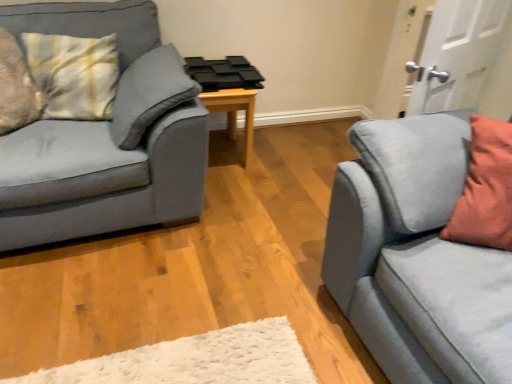
Question: From a real-world perspective, is matte blue couch at left, the first studio couch in the left-to-right sequence, positioned under suede blue studio couch at right, the first studio couch from the right, based on gravity?

Choices:
 (A) yes
 (B) no

Answer: (A)

Question: Is matte blue couch at left, the first studio couch in the left-to-right sequence, aimed at suede blue studio couch at right, the first studio couch from the right?

Choices:
 (A) no
 (B) yes

Answer: (A)

Question: Is matte blue couch at left, the first studio couch in the left-to-right sequence, directly adjacent to suede blue studio couch at right, the first studio couch from the right?

Choices:
 (A) yes
 (B) no

Answer: (B)

Question: Considering the relative positions of matte blue couch at left, which is the 2th studio couch from right to left, and suede blue studio couch at right, the first studio couch from the right, in the image provided, is matte blue couch at left, which is the 2th studio couch from right to left, to the right of suede blue studio couch at right, the first studio couch from the right, from the viewer's perspective?

Choices:
 (A) yes
 (B) no

Answer: (B)

Question: Can you confirm if matte blue couch at left, the first studio couch in the left-to-right sequence, is wider than suede blue studio couch at right, the first studio couch from the right?

Choices:
 (A) no
 (B) yes

Answer: (B)

Question: Does matte blue couch at left, which is the 2th studio couch from right to left, lie in front of suede blue studio couch at right, the first studio couch from the right?

Choices:
 (A) yes
 (B) no

Answer: (B)

Question: From the image's perspective, does suede blue studio couch at right, which ranks as the second studio couch in left-to-right order, appear higher than matte blue couch at left, the first studio couch in the left-to-right sequence?

Choices:
 (A) no
 (B) yes

Answer: (A)

Question: Is matte blue couch at left, which is the 2th studio couch from right to left, at the back of suede blue studio couch at right, the first studio couch from the right?

Choices:
 (A) no
 (B) yes

Answer: (A)

Question: Is suede blue studio couch at right, which ranks as the second studio couch in left-to-right order, next to matte blue couch at left, the first studio couch in the left-to-right sequence?

Choices:
 (A) no
 (B) yes

Answer: (A)

Question: Is suede blue studio couch at right, which ranks as the second studio couch in left-to-right order, closer to the viewer compared to matte blue couch at left, which is the 2th studio couch from right to left?

Choices:
 (A) yes
 (B) no

Answer: (A)

Question: From a real-world perspective, is suede blue studio couch at right, the first studio couch from the right, on matte blue couch at left, the first studio couch in the left-to-right sequence?

Choices:
 (A) yes
 (B) no

Answer: (A)

Question: From the image's perspective, is suede blue studio couch at right, which ranks as the second studio couch in left-to-right order, located beneath matte blue couch at left, the first studio couch in the left-to-right sequence?

Choices:
 (A) no
 (B) yes

Answer: (B)

Question: Can you confirm if suede blue studio couch at right, which ranks as the second studio couch in left-to-right order, is wider than white matte door at upper right?

Choices:
 (A) yes
 (B) no

Answer: (A)